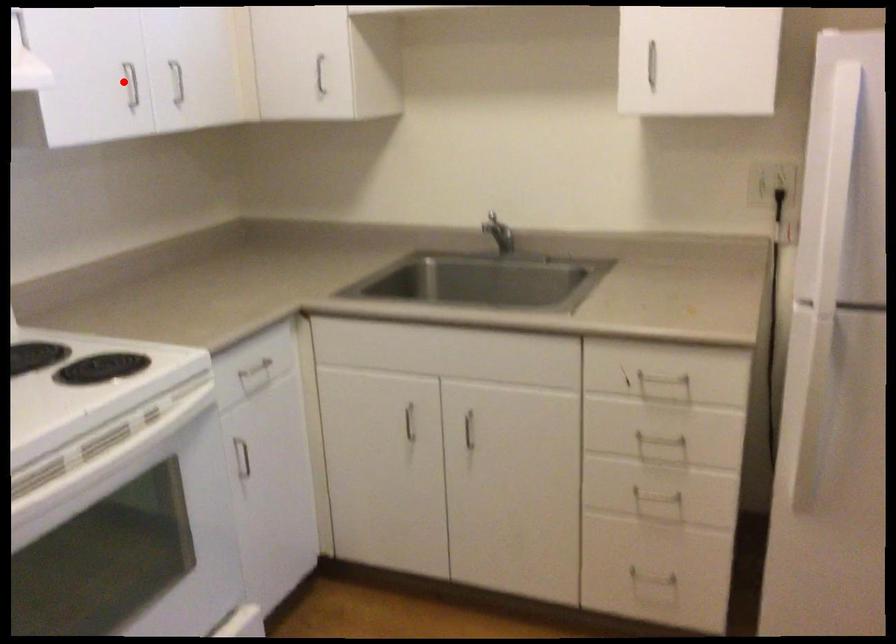
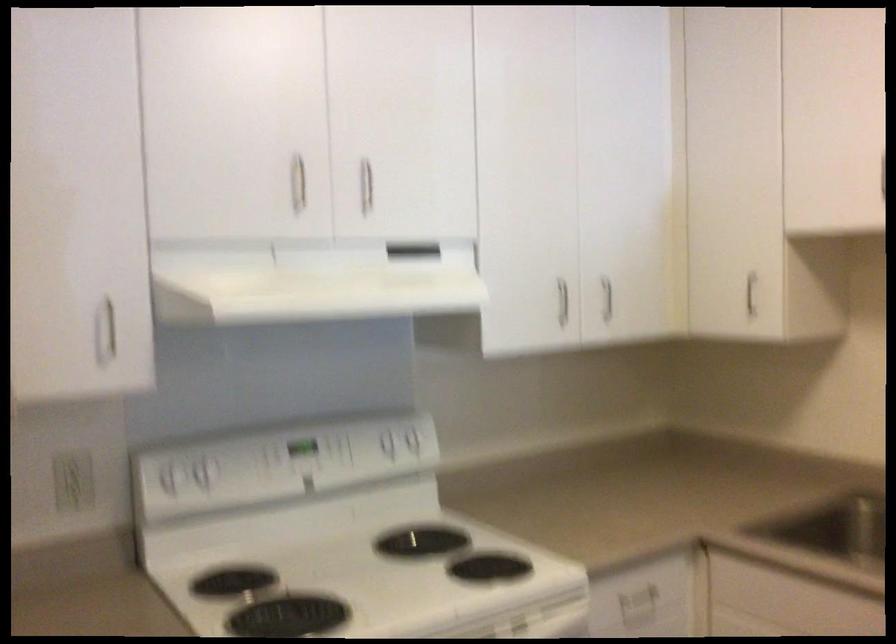
Question: A red point is marked in image1. In image2, is the corresponding 3D point closer to the camera or farther? Reply with the corresponding letter.

Choices:
 (A) The corresponding 3D point is closer.
 (B) The corresponding 3D point is farther.

Answer: (B)